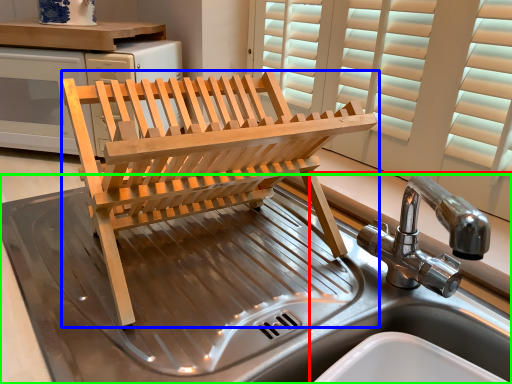
Question: Which is nearer to the sink (highlighted by a red box)? furniture (highlighted by a blue box) or sink (highlighted by a green box).

Choices:
 (A) furniture
 (B) sink

Answer: (A)